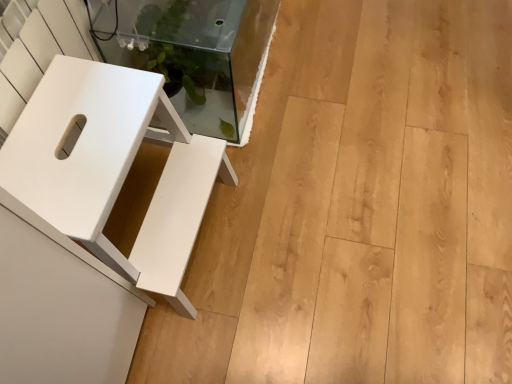
Locate an element on the screen. Image resolution: width=512 pixels, height=384 pixels. vacant region above white matte stool at left (from a real-world perspective) is located at coordinates (85, 134).